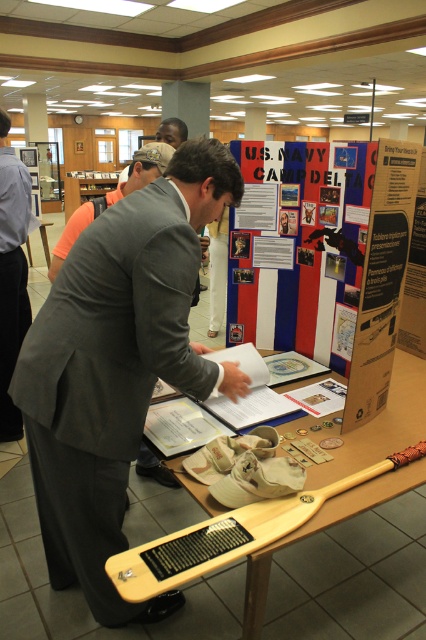
What is located at the point with coordinates (106, 380) in the image?

The point at coordinates (106, 380) marks the location of the gray wool business suit at center.

You are organizing a display at the library and need to ensure that all items fit within a designated area. The matte paper poster at center and the gray suit at center are both part of the display. Which item requires more space to display properly?

The gray suit at center requires more space because it occupies more area than the matte paper poster at center, as stated in the description.